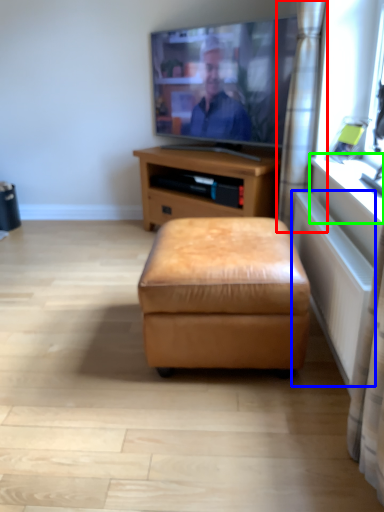
Question: Which object is positioned closest to curtain (highlighted by a red box)? Select from radiator (highlighted by a blue box) and window sill (highlighted by a green box).

Choices:
 (A) radiator
 (B) window sill

Answer: (B)